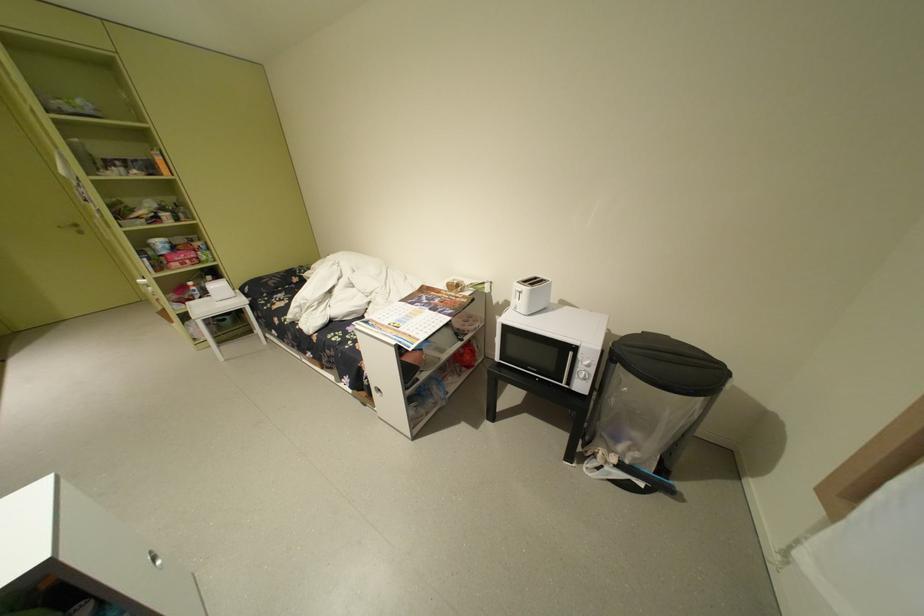
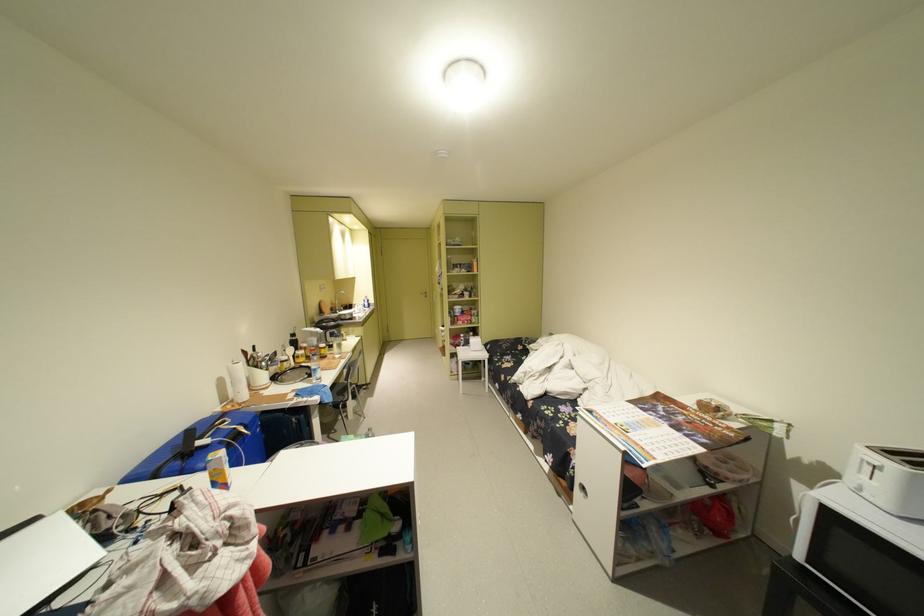
Where in the second image is the point corresponding to [382,395] from the first image?

(582, 488)